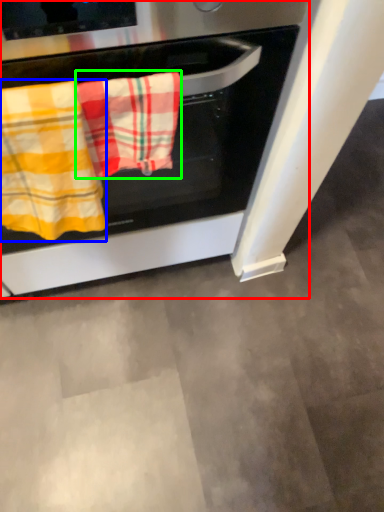
Question: Which is farther away from oven (highlighted by a red box)? beach towel (highlighted by a blue box) or beach towel (highlighted by a green box)?

Choices:
 (A) beach towel
 (B) beach towel

Answer: (A)